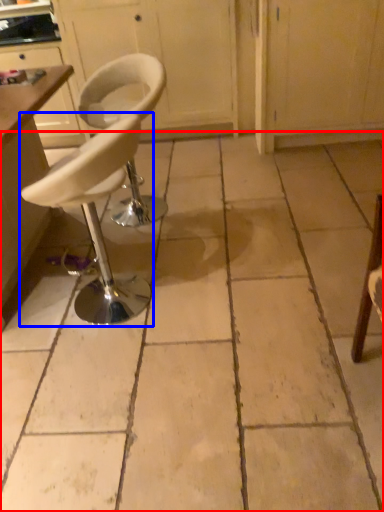
Question: Which object appears closest to the camera in this image, concrete (highlighted by a red box) or chair (highlighted by a blue box)?

Choices:
 (A) concrete
 (B) chair

Answer: (A)